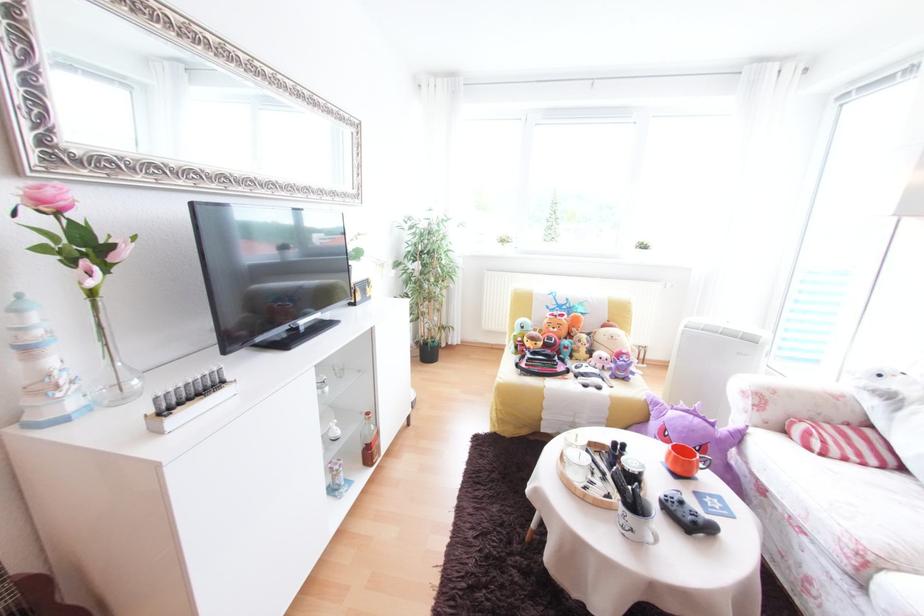
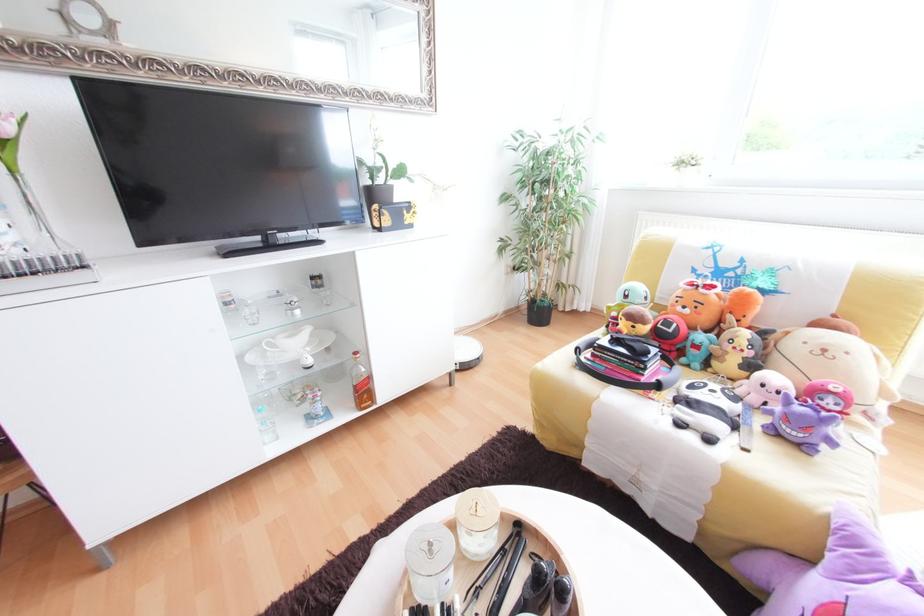
Question: Based on the continuous images, in which direction is the camera rotating? Reply with the corresponding letter.

Choices:
 (A) Left
 (B) Right
 (C) Up
 (D) Down

Answer: (A)